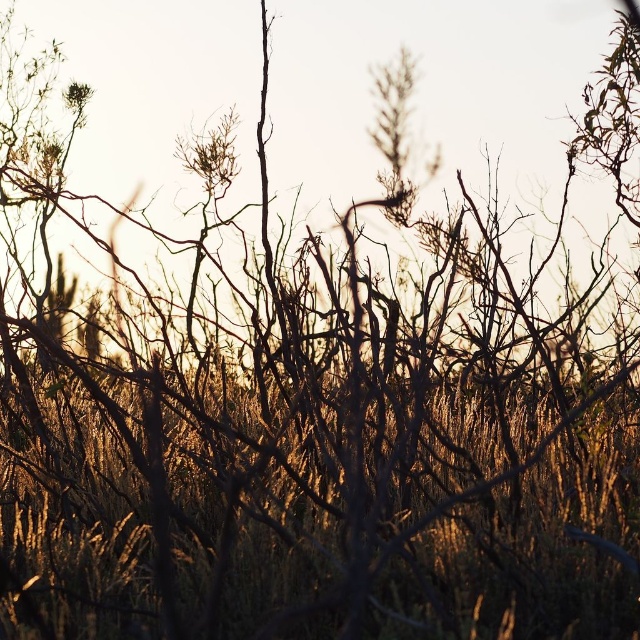
Question: Does brown dry grass at center appear over brown dry branch at upper center?

Choices:
 (A) yes
 (B) no

Answer: (B)

Question: Where is brown dry grass at center located in relation to brown dry branch at upper center in the image?

Choices:
 (A) below
 (B) above

Answer: (A)

Question: Which point is closer to the camera taking this photo?

Choices:
 (A) (433, 620)
 (B) (67, 104)

Answer: (A)

Question: Which object is positioned closest to the green matte flower at upper left?

Choices:
 (A) brown dry branch at upper center
 (B) brown dry grass at center

Answer: (A)

Question: In this image, where is brown dry branch at upper center located relative to green matte flower at upper left?

Choices:
 (A) right
 (B) left

Answer: (A)

Question: Which object is closer to the camera taking this photo?

Choices:
 (A) green matte flower at upper left
 (B) brown dry grass at center

Answer: (B)